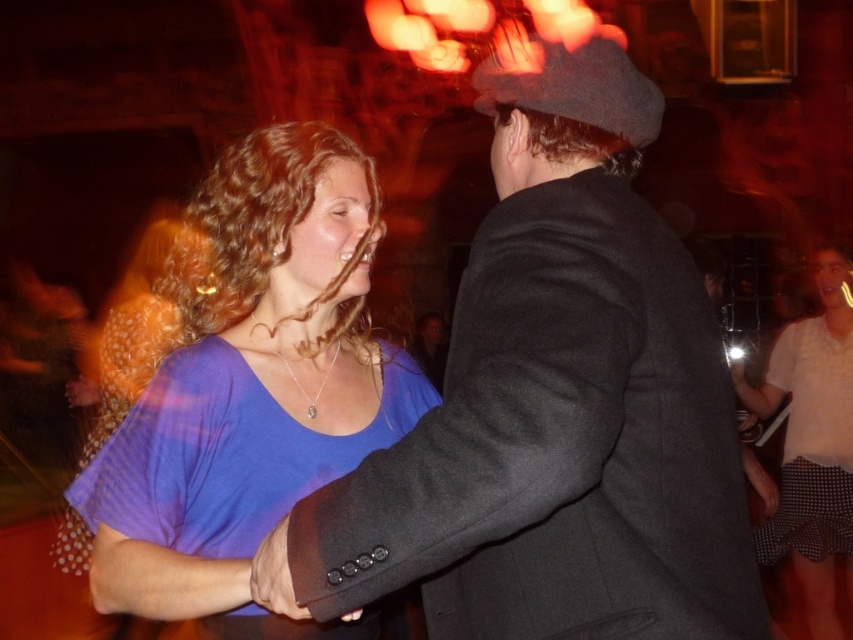
You are at a party and notice two items in the scene. One is the matte black coat at center, and the other is the white dotted skirt at lower right. Which item appears taller in the image?

The white dotted skirt at lower right appears taller than the matte black coat at center because the matte black coat at center is not as tall as the white dotted skirt at lower right.